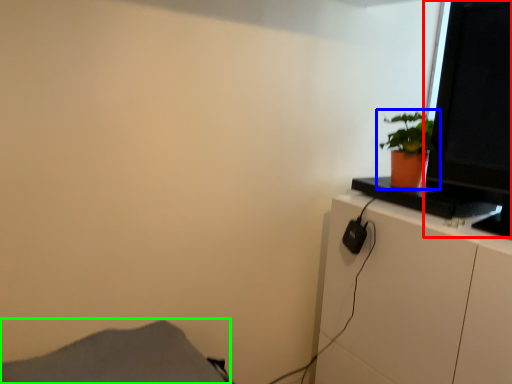
Question: Based on their relative distances, which object is nearer to computer monitor (highlighted by a red box)? Choose from houseplant (highlighted by a blue box) and plain (highlighted by a green box).

Choices:
 (A) houseplant
 (B) plain

Answer: (A)